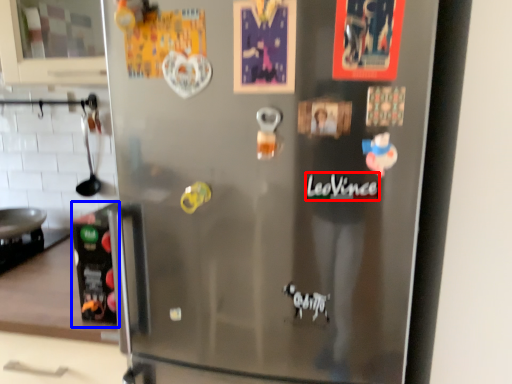
Question: Among these objects, which one is farthest to the camera, writing (highlighted by a red box) or appliance (highlighted by a blue box)?

Choices:
 (A) writing
 (B) appliance

Answer: (B)